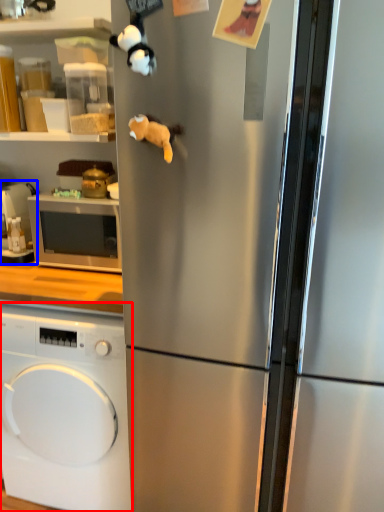
Question: Which of the following is the closest to the observer, washing machine (highlighted by a red box) or appliance (highlighted by a blue box)?

Choices:
 (A) washing machine
 (B) appliance

Answer: (A)